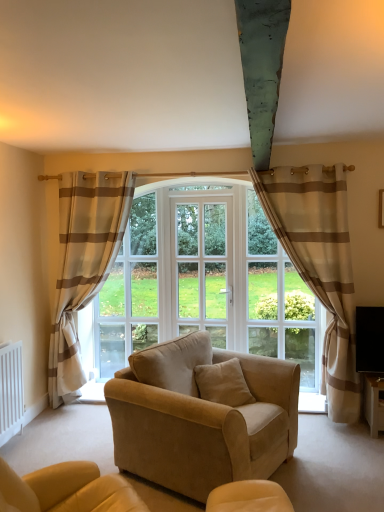
Question: Does beige striped curtain at right, the second curtain from the left, lie in front of white plastic radiator at lower left?

Choices:
 (A) no
 (B) yes

Answer: (A)

Question: From a real-world perspective, is beige striped curtain at right, the 1th curtain from the right, physically below white plastic radiator at lower left?

Choices:
 (A) no
 (B) yes

Answer: (A)

Question: Considering the relative sizes of beige striped curtain at right, the 1th curtain from the right, and white plastic radiator at lower left in the image provided, is beige striped curtain at right, the 1th curtain from the right, smaller than white plastic radiator at lower left?

Choices:
 (A) no
 (B) yes

Answer: (A)

Question: Does beige striped curtain at right, the second curtain from the left, have a lesser height compared to white plastic radiator at lower left?

Choices:
 (A) yes
 (B) no

Answer: (B)

Question: Is white plastic radiator at lower left completely or partially inside beige striped curtain at right, the second curtain from the left?

Choices:
 (A) no
 (B) yes

Answer: (A)

Question: Looking at their shapes, would you say clear glass window at center is wider or thinner than suede beige couch at center?

Choices:
 (A) wide
 (B) thin

Answer: (B)

Question: From the image's perspective, is clear glass window at center above or below suede beige couch at center?

Choices:
 (A) above
 (B) below

Answer: (A)

Question: Is clear glass window at center taller or shorter than suede beige couch at center?

Choices:
 (A) tall
 (B) short

Answer: (A)

Question: Considering the relative positions of clear glass window at center and suede beige couch at center in the image provided, is clear glass window at center to the left or to the right of suede beige couch at center?

Choices:
 (A) left
 (B) right

Answer: (A)

Question: Is clear glass window at center to the left or to the right of beige striped curtain at left, the 1th curtain when ordered from left to right, in the image?

Choices:
 (A) right
 (B) left

Answer: (A)

Question: Does point (94, 340) appear closer or farther from the camera than point (79, 366)?

Choices:
 (A) farther
 (B) closer

Answer: (A)

Question: From a real-world perspective, relative to beige striped curtain at left, acting as the second curtain starting from the right, is clear glass window at center vertically above or below?

Choices:
 (A) above
 (B) below

Answer: (B)

Question: Looking at the image, does clear glass window at center seem bigger or smaller compared to beige striped curtain at left, the 1th curtain when ordered from left to right?

Choices:
 (A) big
 (B) small

Answer: (B)

Question: From the image's perspective, is white plastic radiator at lower left above or below suede beige couch at center?

Choices:
 (A) above
 (B) below

Answer: (B)

Question: Is white plastic radiator at lower left taller or shorter than suede beige couch at center?

Choices:
 (A) short
 (B) tall

Answer: (B)